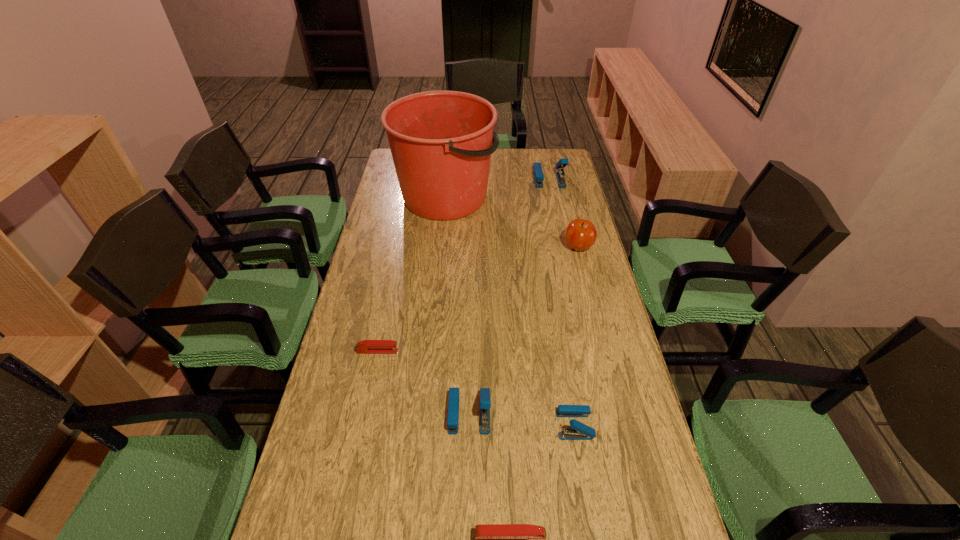
I want to click on vacant space that is in between the pink bucket and the second tallest stapler, so pyautogui.click(x=458, y=305).

Identify the location of empty space that is in between the fifth tallest object and the fourth shortest stapler. (522, 419).

Identify which object is the fifth nearest to the farthest blue stapler. Please provide its 2D coordinates. Your answer should be formatted as a tuple, i.e. [(x, y)], where the tuple contains the x and y coordinates of a point satisfying the conditions above.

[(579, 431)]

Select which object appears as the fifth closest to the nearer red stapler. Please provide its 2D coordinates. Your answer should be formatted as a tuple, i.e. [(x, y)], where the tuple contains the x and y coordinates of a point satisfying the conditions above.

[(441, 142)]

Choose which stapler is the third nearest neighbor to the second farthest stapler. Please provide its 2D coordinates. Your answer should be formatted as a tuple, i.e. [(x, y)], where the tuple contains the x and y coordinates of a point satisfying the conditions above.

[(491, 539)]

Locate which stapler ranks in proximity to the biggest blue stapler. Please provide its 2D coordinates. Your answer should be formatted as a tuple, i.e. [(x, y)], where the tuple contains the x and y coordinates of a point satisfying the conditions above.

[(366, 346)]

Where is `the third closest blue stapler to the shortest object`? the third closest blue stapler to the shortest object is located at coordinates (537, 172).

Identify the location of the closest blue stapler relative to the pink bucket. (537, 172).

Choose which red stapler is the nearest neighbor to the fifth nearest object. Please provide its 2D coordinates. Your answer should be formatted as a tuple, i.e. [(x, y)], where the tuple contains the x and y coordinates of a point satisfying the conditions above.

[(366, 346)]

Locate which red stapler ranks in proximity to the apple. Please provide its 2D coordinates. Your answer should be formatted as a tuple, i.e. [(x, y)], where the tuple contains the x and y coordinates of a point satisfying the conditions above.

[(366, 346)]